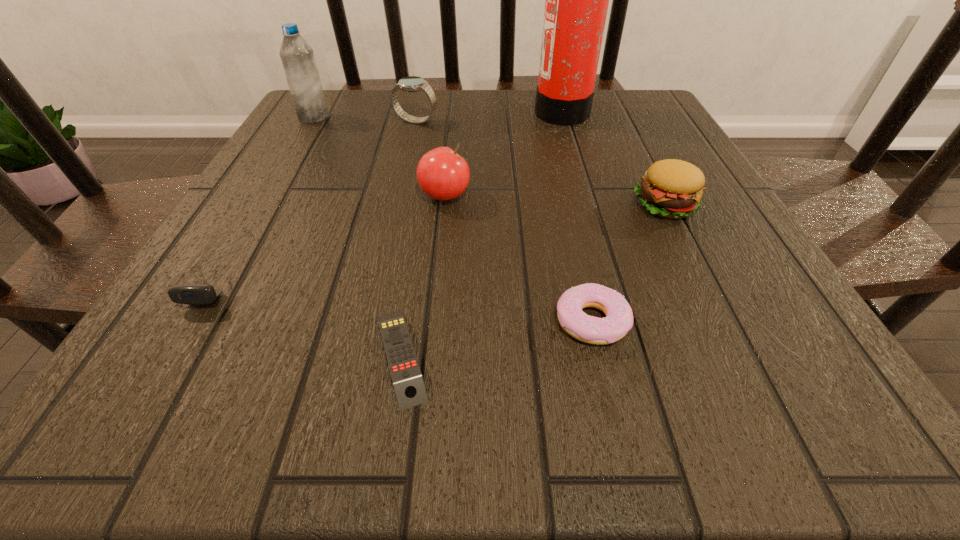
Find the location of a particular element. free area in between the water bottle and the apple is located at coordinates (379, 157).

The width and height of the screenshot is (960, 540). In order to click on vacant area that lies between the fifth tallest object and the watch in this screenshot , I will do `click(540, 163)`.

The width and height of the screenshot is (960, 540). Identify the location of free space between the remote control and the webcam. (310, 312).

At what (x,y) coordinates should I click in order to perform the action: click on vacant space that's between the apple and the rightmost object. Please return your answer as a coordinate pair (x, y). The width and height of the screenshot is (960, 540). Looking at the image, I should click on (555, 200).

Where is `unoccupied position between the tallest object and the webcam`? unoccupied position between the tallest object and the webcam is located at coordinates (390, 189).

Locate which object ranks in proximity to the tallest object. Please provide its 2D coordinates. Your answer should be formatted as a tuple, i.e. [(x, y)], where the tuple contains the x and y coordinates of a point satisfying the conditions above.

[(670, 188)]

In order to click on object that stands as the sixth closest to the watch in this screenshot , I will do [409, 387].

Where is `free space that satisfies the following two spatial constraints: 1. on the front side of the tallest object; 2. on the front-facing side of the webcam`? This screenshot has height=540, width=960. free space that satisfies the following two spatial constraints: 1. on the front side of the tallest object; 2. on the front-facing side of the webcam is located at coordinates (608, 268).